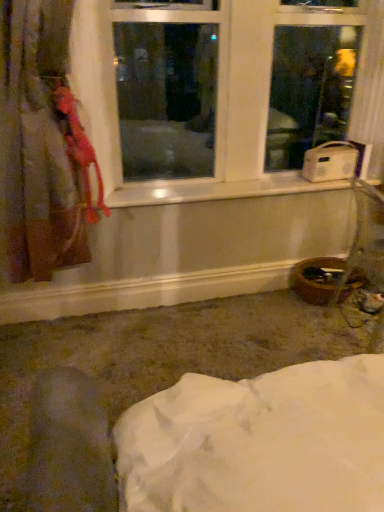
Question: Does velvet-like pink curtain at left contain white plastic window at upper center?

Choices:
 (A) no
 (B) yes

Answer: (A)

Question: Considering the relative positions of velvet-like pink curtain at left and white plastic window at upper center in the image provided, is velvet-like pink curtain at left in front of white plastic window at upper center?

Choices:
 (A) no
 (B) yes

Answer: (B)

Question: Can you confirm if velvet-like pink curtain at left is positioned to the right of white plastic window at upper center?

Choices:
 (A) no
 (B) yes

Answer: (A)

Question: From the image's perspective, is velvet-like pink curtain at left located beneath white plastic window at upper center?

Choices:
 (A) no
 (B) yes

Answer: (B)

Question: Is velvet-like pink curtain at left bigger than white plastic window at upper center?

Choices:
 (A) yes
 (B) no

Answer: (B)

Question: From a real-world perspective, is velvet-like pink curtain at left beneath white plastic window at upper center?

Choices:
 (A) no
 (B) yes

Answer: (B)

Question: Is white plastic window sill at center facing towards white plastic radio at right?

Choices:
 (A) yes
 (B) no

Answer: (B)

Question: Does white plastic window sill at center have a larger size compared to white plastic radio at right?

Choices:
 (A) yes
 (B) no

Answer: (A)

Question: Is white plastic window sill at center beside white plastic radio at right?

Choices:
 (A) yes
 (B) no

Answer: (B)

Question: Can you confirm if white plastic window sill at center is wider than white plastic radio at right?

Choices:
 (A) yes
 (B) no

Answer: (A)

Question: Is white plastic window sill at center to the left of white plastic radio at right from the viewer's perspective?

Choices:
 (A) yes
 (B) no

Answer: (A)

Question: Is there a large distance between white plastic window sill at center and white plastic radio at right?

Choices:
 (A) yes
 (B) no

Answer: (B)

Question: Is the position of white plastic window at upper center less distant than that of white plastic radio at right?

Choices:
 (A) yes
 (B) no

Answer: (A)